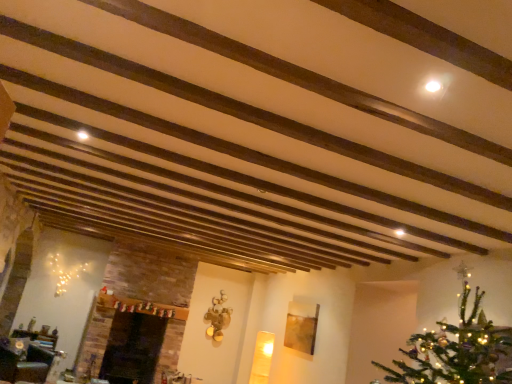
Question: Is wooden coffee table at lower left bigger or smaller than black glossy fireplace at lower left?

Choices:
 (A) big
 (B) small

Answer: (B)

Question: Considering the relative positions of wooden coffee table at lower left and black glossy fireplace at lower left in the image provided, is wooden coffee table at lower left to the left or to the right of black glossy fireplace at lower left?

Choices:
 (A) left
 (B) right

Answer: (A)

Question: From the image's perspective, relative to black glossy fireplace at lower left, is wooden coffee table at lower left above or below?

Choices:
 (A) below
 (B) above

Answer: (B)

Question: Does point (123, 374) appear closer or farther from the camera than point (10, 339)?

Choices:
 (A) farther
 (B) closer

Answer: (A)

Question: Considering the positions of black glossy fireplace at lower left and wooden coffee table at lower left in the image, is black glossy fireplace at lower left taller or shorter than wooden coffee table at lower left?

Choices:
 (A) short
 (B) tall

Answer: (B)

Question: From the image's perspective, is black glossy fireplace at lower left positioned above or below wooden coffee table at lower left?

Choices:
 (A) above
 (B) below

Answer: (B)

Question: Considering the positions of black glossy fireplace at lower left and wooden coffee table at lower left in the image, is black glossy fireplace at lower left wider or thinner than wooden coffee table at lower left?

Choices:
 (A) wide
 (B) thin

Answer: (A)